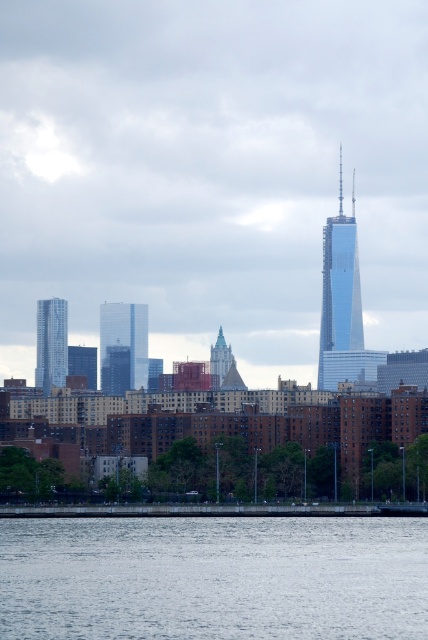
You are a drone operator who needs to fly a drone from the gray water at lower center to the metallic glass skyscraper at left. What is the approximate distance you need to cover?

The distance between the gray water at lower center and the metallic glass skyscraper at left is 226.03 feet, so the drone operator needs to cover approximately 226 feet.

You are standing at point (214, 579) in the city skyline image. What do you see directly below you?

At point (214, 579) lies gray water at lower center.